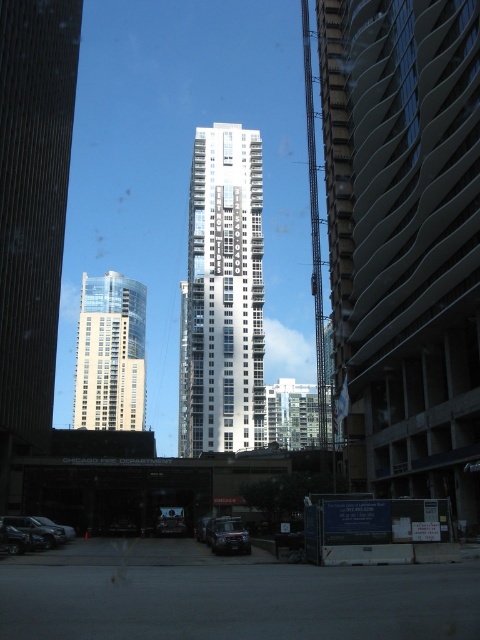
Between clear glass tower at center and metallic silver car at center, which one is positioned lower?

metallic silver car at center is below.

From the picture: Which is above, clear glass tower at center or metallic silver car at center?

clear glass tower at center is above.

Between point (120, 380) and point (172, 515), which one is positioned in front?

Point (172, 515) is more forward.

Locate an element on the screen. The image size is (480, 640). clear glass tower at center is located at coordinates (110, 353).

Measure the distance from clear glass tower at center to shiny black car at lower left.

A distance of 180.82 meters exists between clear glass tower at center and shiny black car at lower left.

Describe the element at coordinates (110, 353) in the screenshot. I see `clear glass tower at center` at that location.

Does point (136, 410) come behind point (61, 536)?

Yes, it is behind point (61, 536).

Find the location of a particular element. clear glass tower at center is located at coordinates (110, 353).

Can you confirm if shiny black car at lower left is shorter than shiny black car at center?

No.

What do you see at coordinates (39, 529) in the screenshot? The image size is (480, 640). I see `shiny black car at lower left` at bounding box center [39, 529].

The width and height of the screenshot is (480, 640). I want to click on shiny black car at lower left, so click(39, 529).